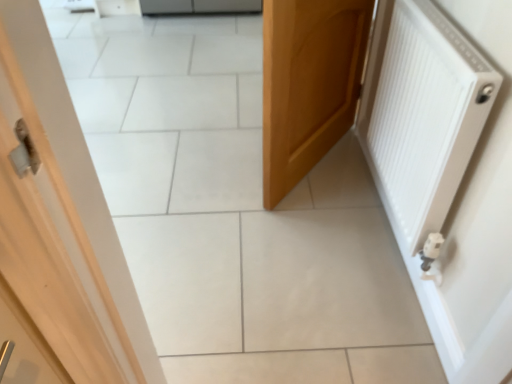
Question: Should I look upward or downward to see white matte radiator at right?

Choices:
 (A) down
 (B) up

Answer: (B)

Question: Is wooden door at center positioned beyond the bounds of white matte radiator at right?

Choices:
 (A) yes
 (B) no

Answer: (A)

Question: From a real-world perspective, is wooden door at center located higher than white matte radiator at right?

Choices:
 (A) yes
 (B) no

Answer: (B)

Question: Is wooden door at center behind white matte radiator at right?

Choices:
 (A) yes
 (B) no

Answer: (A)

Question: Considering the relative sizes of wooden door at center and white matte radiator at right in the image provided, is wooden door at center shorter than white matte radiator at right?

Choices:
 (A) no
 (B) yes

Answer: (A)

Question: Does wooden door at center appear on the left side of white matte radiator at right?

Choices:
 (A) yes
 (B) no

Answer: (A)

Question: From the image's perspective, is wooden door at center located above white matte radiator at right?

Choices:
 (A) no
 (B) yes

Answer: (B)

Question: Would you consider white matte radiator at right to be distant from wooden door at center?

Choices:
 (A) no
 (B) yes

Answer: (A)

Question: From the image's perspective, is white matte radiator at right beneath wooden door at center?

Choices:
 (A) yes
 (B) no

Answer: (A)

Question: Can you confirm if white matte radiator at right is smaller than wooden door at center?

Choices:
 (A) yes
 (B) no

Answer: (A)

Question: Would you say wooden door at center is part of white matte radiator at right's contents?

Choices:
 (A) no
 (B) yes

Answer: (A)

Question: Considering the relative sizes of white matte radiator at right and wooden door at center in the image provided, is white matte radiator at right wider than wooden door at center?

Choices:
 (A) no
 (B) yes

Answer: (A)

Question: Is the position of white matte radiator at right more distant than that of wooden door at center?

Choices:
 (A) no
 (B) yes

Answer: (A)

Question: Does point (442, 137) appear closer or farther from the camera than point (269, 3)?

Choices:
 (A) closer
 (B) farther

Answer: (A)